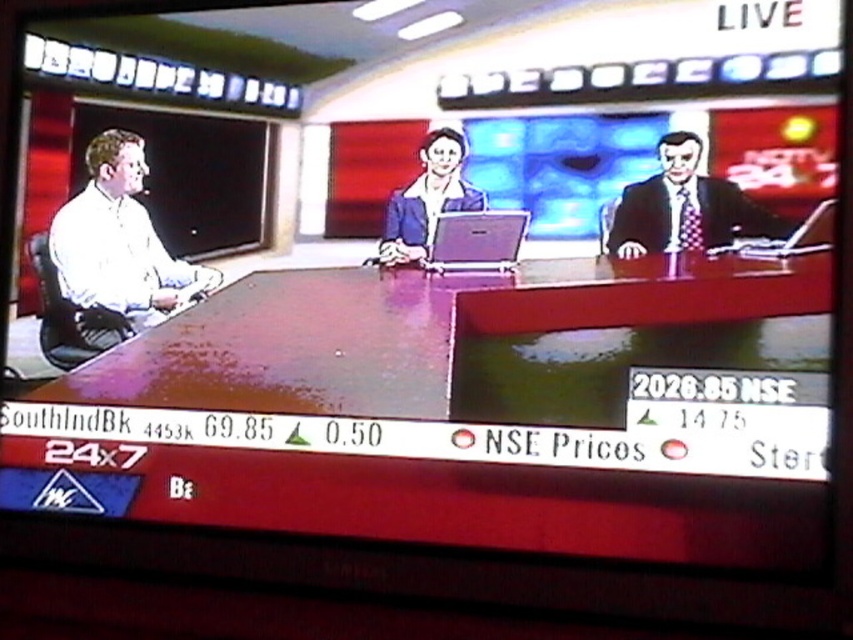
Question: Which is farther from the matte black suit at upper right?

Choices:
 (A) white glossy shirt at left
 (B) silver metallic laptop at center
 (C) matte black laptop at right

Answer: (A)

Question: Which point is farther to the camera?

Choices:
 (A) 807,228
 (B) 699,228
 (C) 178,284

Answer: (C)

Question: Does matte black suit at upper right appear on the left side of matte blue blazer at center?

Choices:
 (A) yes
 (B) no

Answer: (B)

Question: Can you confirm if matte blue blazer at center is wider than matte black laptop at right?

Choices:
 (A) no
 (B) yes

Answer: (B)

Question: Observing the image, what is the correct spatial positioning of matte blue blazer at center in reference to matte black laptop at right?

Choices:
 (A) above
 (B) below

Answer: (A)

Question: Estimate the real-world distances between objects in this image. Which object is farther from the matte black laptop at right?

Choices:
 (A) matte blue blazer at center
 (B) matte black suit at upper right

Answer: (A)